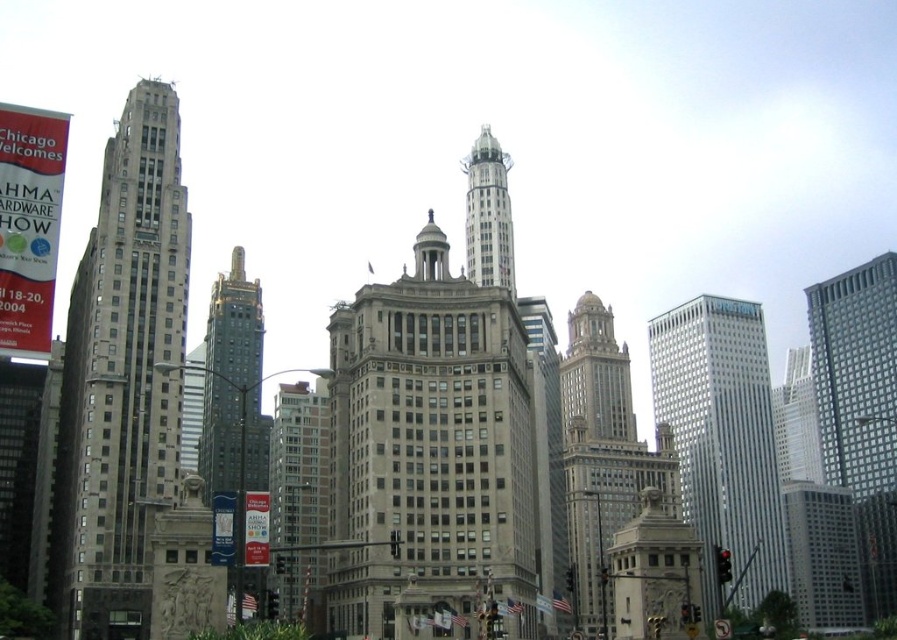
Which is behind, point (76, 355) or point (315, 492)?

Point (315, 492)

Does gray stone skyscraper at left have a lesser height compared to brick textured building at center?

No.

Describe the element at coordinates (120, 378) in the screenshot. The image size is (897, 640). I see `gray stone skyscraper at left` at that location.

The image size is (897, 640). I want to click on gray stone skyscraper at left, so click(120, 378).

Does stone tower at center have a larger size compared to gold/bronze metal tower at center-left?

Correct, stone tower at center is larger in size than gold/bronze metal tower at center-left.

Is stone tower at center taller than gold/bronze metal tower at center-left?

Correct, stone tower at center is much taller as gold/bronze metal tower at center-left.

Between point (623, 481) and point (220, 417), which one is positioned behind?

The point (623, 481) is more distant.

This screenshot has width=897, height=640. What are the coordinates of `stone tower at center` in the screenshot? It's located at (603, 458).

Can you confirm if silver glass skyscraper at right is positioned above gold/bronze metal tower at center-left?

No, silver glass skyscraper at right is not above gold/bronze metal tower at center-left.

Between point (752, 436) and point (251, 378), which one is positioned behind?

The point (752, 436) is more distant.

Find the location of `silver glass skyscraper at right`. silver glass skyscraper at right is located at coordinates (721, 436).